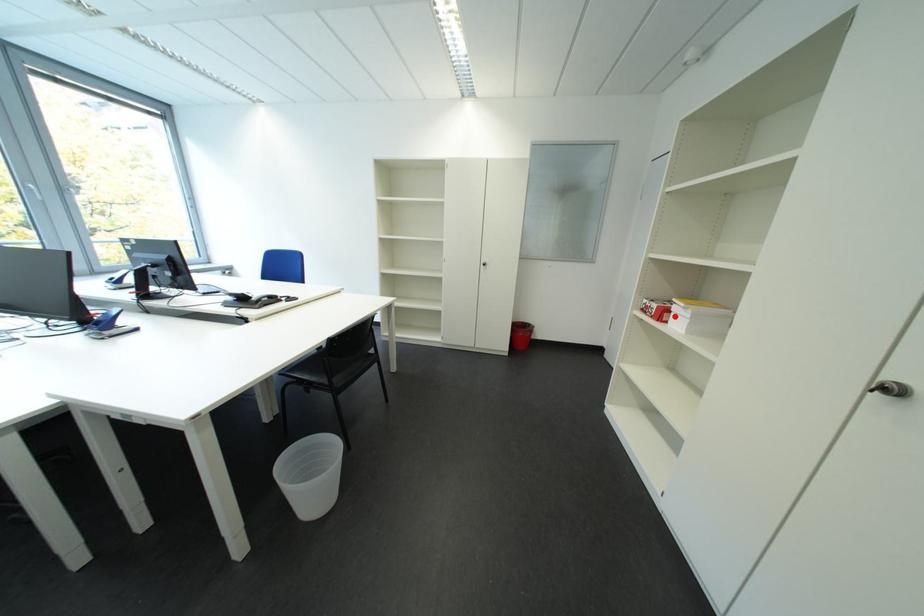
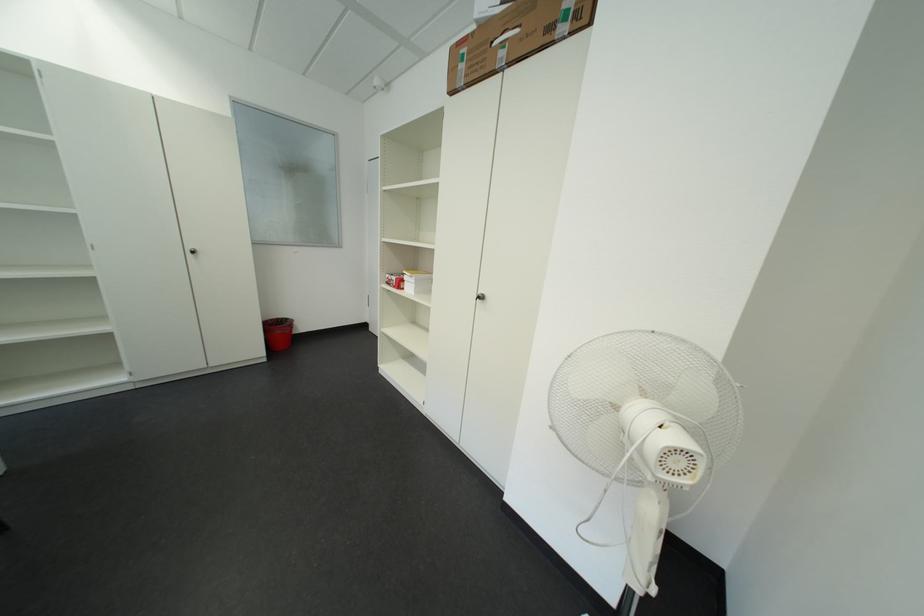
Locate, in the second image, the point that corresponds to the highlighted location in the first image.

(411, 286)